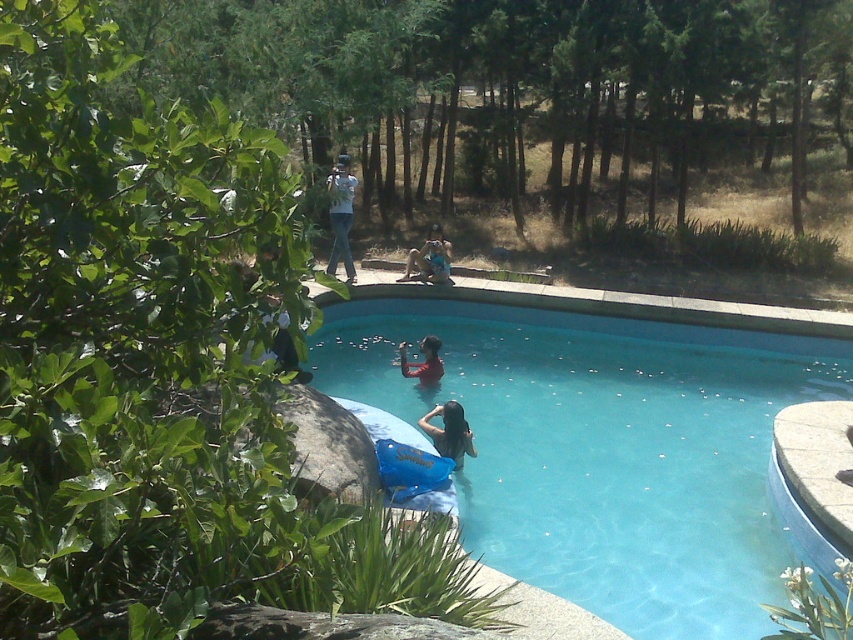
You are a photographer trying to capture a shot of the transparent blue water at center and the matte red shirt at center. Based on their positions, which object is located to the right side of the other?

Answer: The transparent blue water at center is to the right of the matte red shirt at center.

You are planning to take a photo of the white cotton shirt at upper center and the blue fabric at center. Which object should you zoom in on to capture more details without moving closer?

You should zoom in on the white cotton shirt at upper center because its width is smaller than the blue fabric at center, making it easier to capture more details in a closer shot.